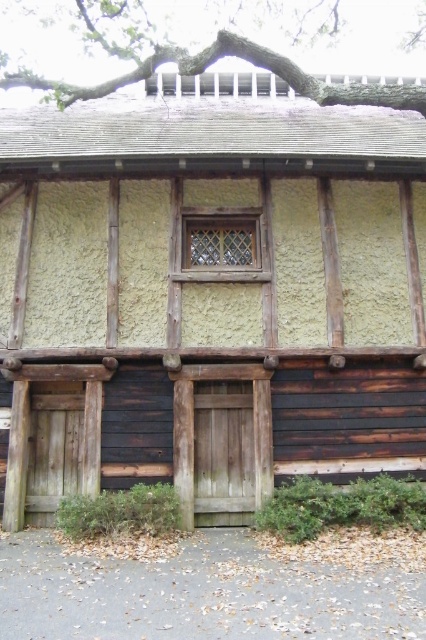
Is rough plaster wall at center bigger than matte wooden window at center?

Indeed, rough plaster wall at center has a larger size compared to matte wooden window at center.

Looking at this image, is rough plaster wall at center positioned behind matte wooden window at center?

No.

This screenshot has height=640, width=426. Identify the location of rough plaster wall at center. (209, 292).